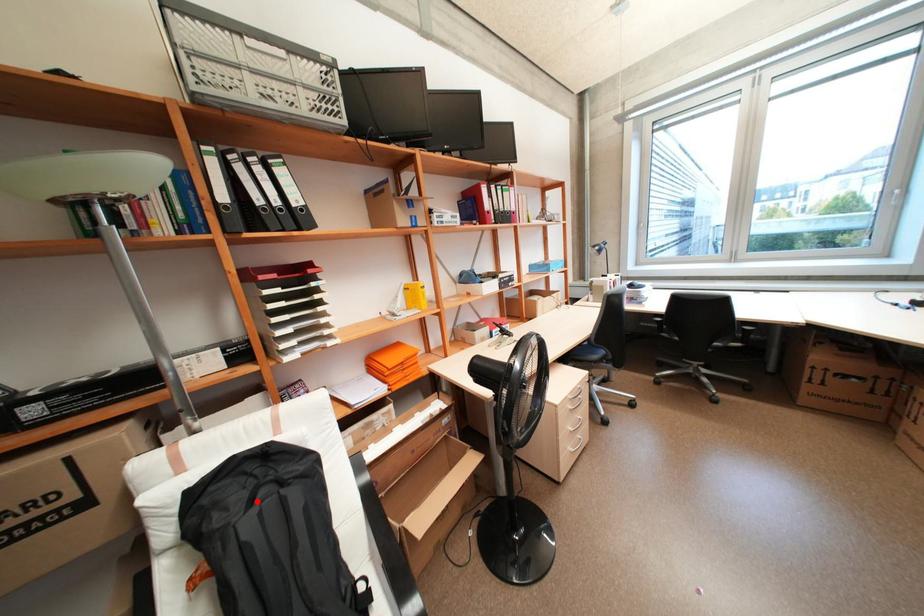
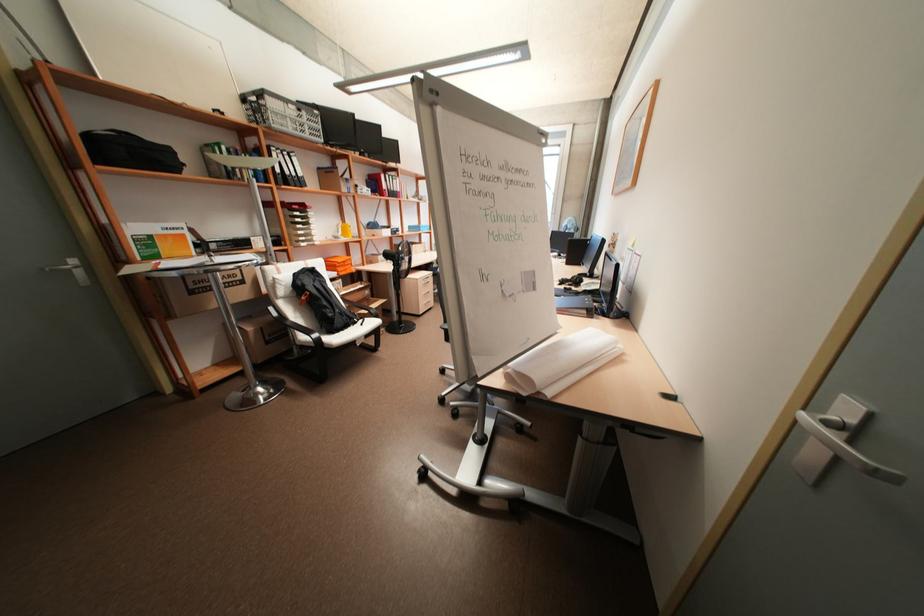
The point at the highlighted location is marked in the first image. Where is the corresponding point in the second image?

(320, 281)